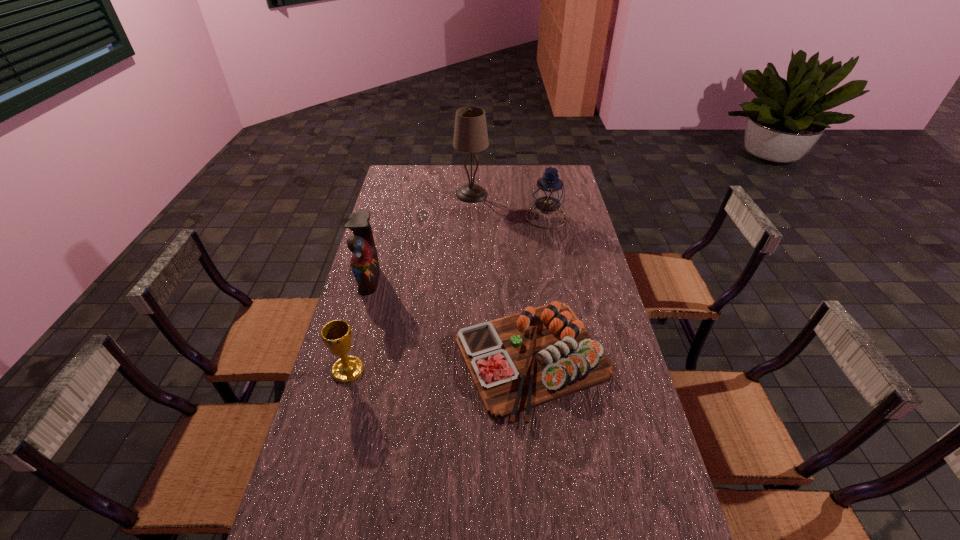
At what (x,y) coordinates should I click in order to perform the action: click on vacant space at the right edge. Please return your answer as a coordinate pair (x, y). This screenshot has height=540, width=960. Looking at the image, I should click on (626, 413).

Find the location of `empty location between the tallest object and the chalice`. empty location between the tallest object and the chalice is located at coordinates (410, 282).

What are the coordinates of `vacant area between the platter and the fourth nearest object` in the screenshot? It's located at (540, 288).

Where is `vacant space that is in between the chalice and the lantern`? This screenshot has height=540, width=960. vacant space that is in between the chalice and the lantern is located at coordinates (447, 294).

The width and height of the screenshot is (960, 540). Find the location of `free area in between the fourth tallest object and the platter`. free area in between the fourth tallest object and the platter is located at coordinates (440, 364).

Where is `empty location between the farthest object and the chalice`? empty location between the farthest object and the chalice is located at coordinates (410, 282).

This screenshot has width=960, height=540. Find the location of `free space between the chalice and the platter`. free space between the chalice and the platter is located at coordinates (440, 364).

Locate which object is the third closest to the tallest object. Please provide its 2D coordinates. Your answer should be formatted as a tuple, i.e. [(x, y)], where the tuple contains the x and y coordinates of a point satisfying the conditions above.

[(521, 361)]

Find the location of a particular element. the fourth closest object to the third nearest object is located at coordinates (549, 193).

Find the location of a particular element. The height and width of the screenshot is (540, 960). vacant space that satisfies the following two spatial constraints: 1. at the face of the parrot; 2. on the right side of the platter is located at coordinates (347, 359).